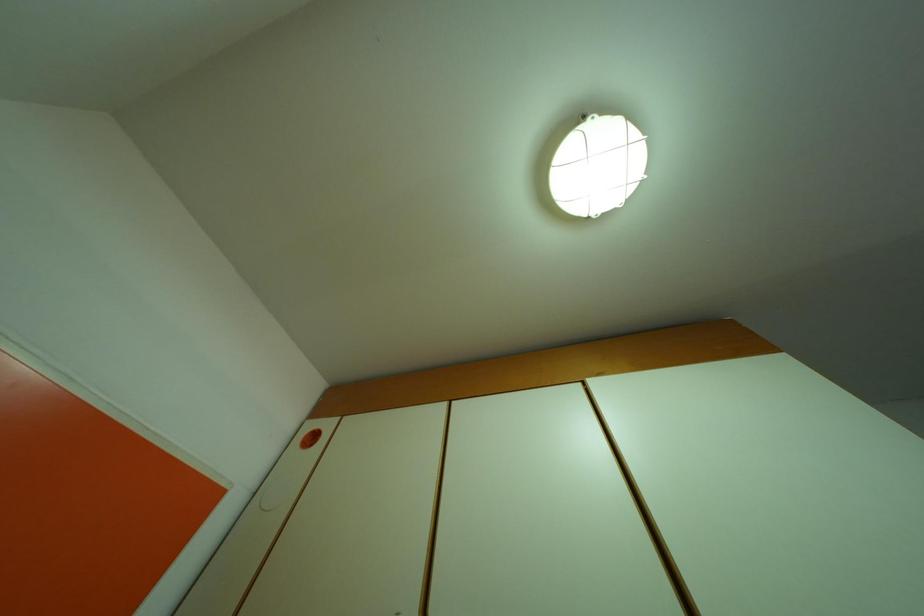
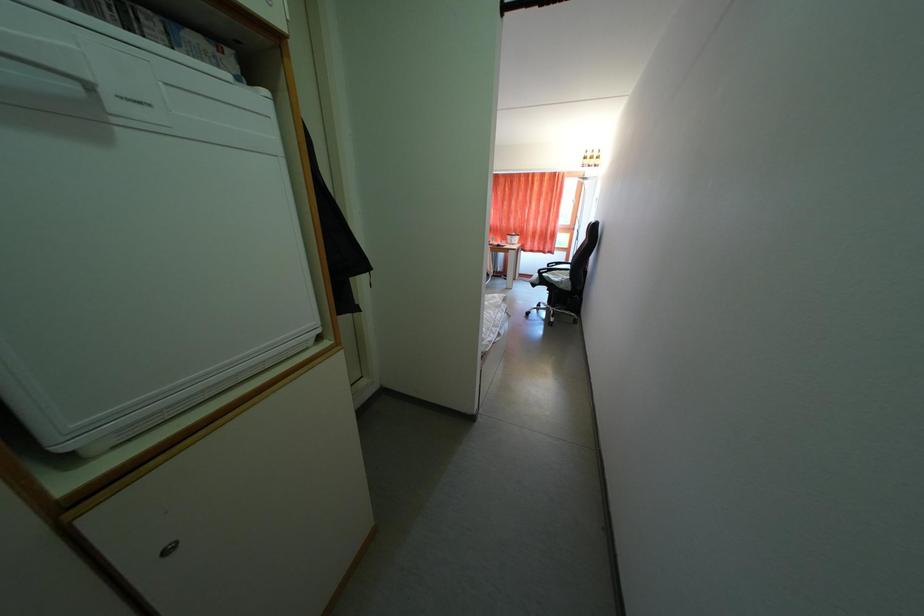
How did the camera likely rotate?

The camera's rotation is toward right-down.